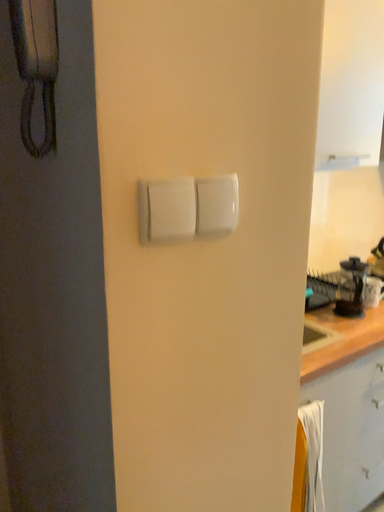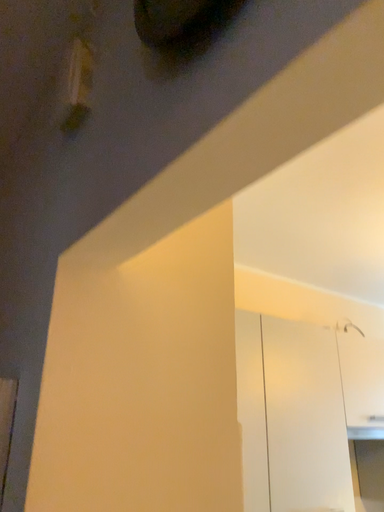
Question: How did the camera likely rotate when shooting the video?

Choices:
 (A) rotated upward
 (B) rotated downward

Answer: (A)